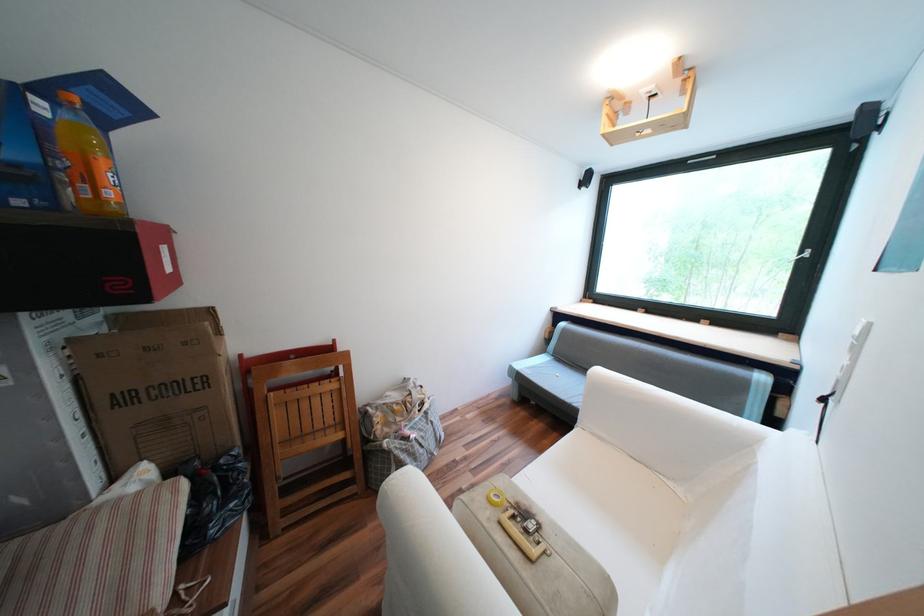
What do you see at coordinates (608, 507) in the screenshot?
I see `the white sofa sitting surface` at bounding box center [608, 507].